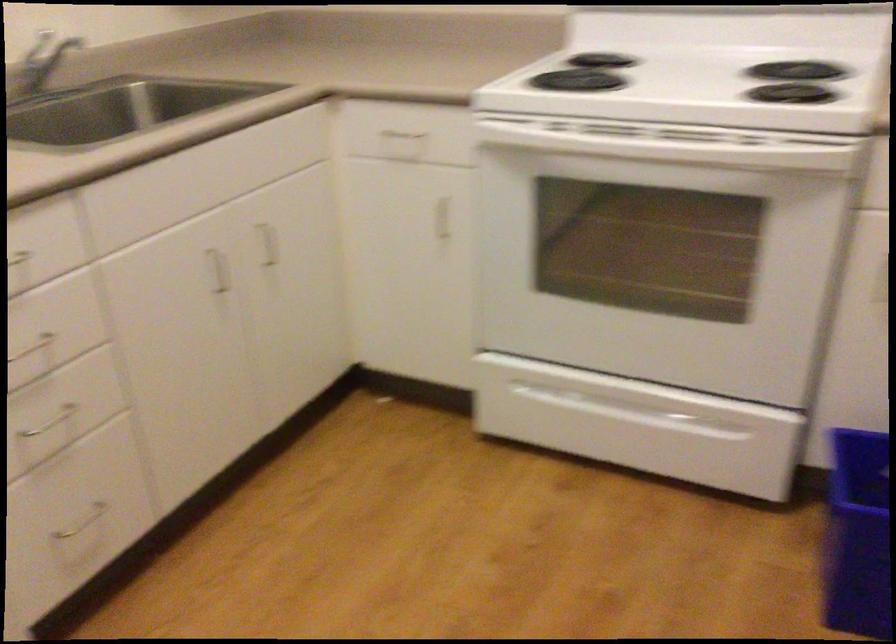
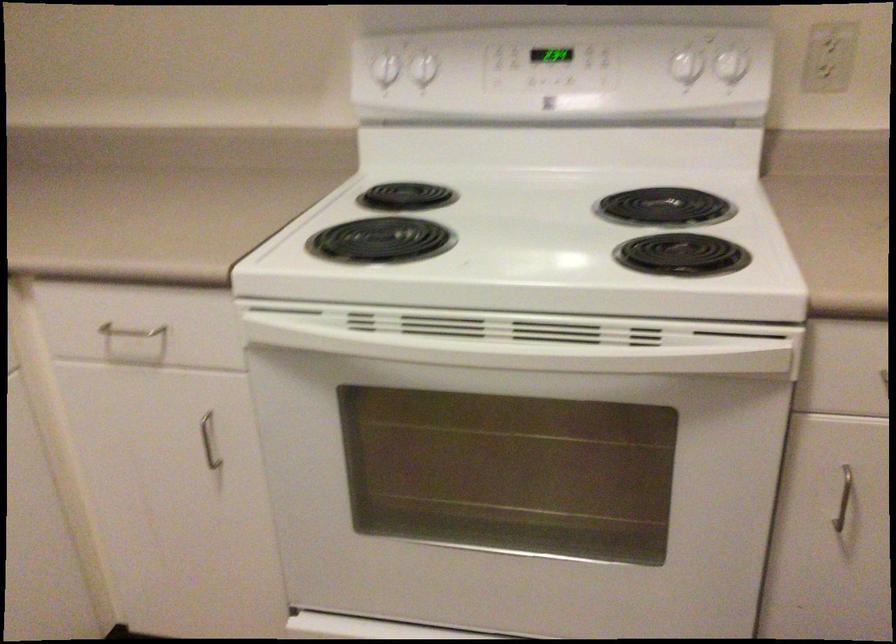
In the second image, find the point that corresponds to (x=669, y=146) in the first image.

(526, 339)